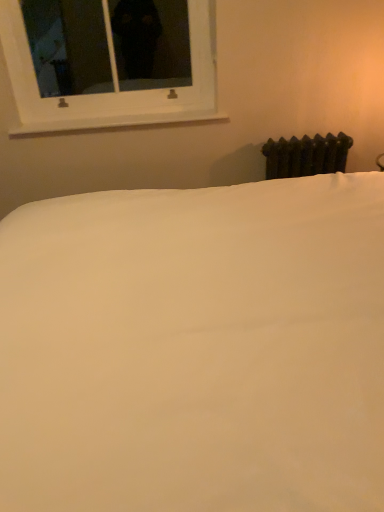
Identify the location of empty space that is ontop of white smooth window sill at upper center (from a real-world perspective). The image size is (384, 512). (109, 113).